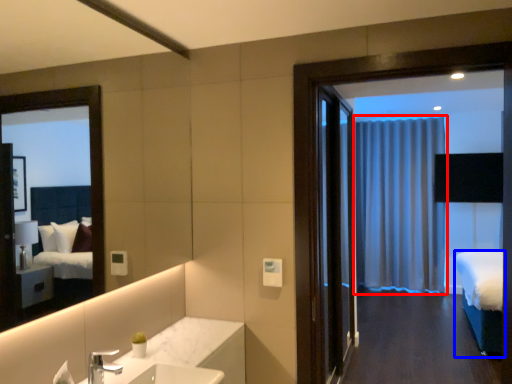
Question: Which point is closer to the camera, curtain (highlighted by a red box) or bed (highlighted by a blue box)?

Choices:
 (A) curtain
 (B) bed

Answer: (B)